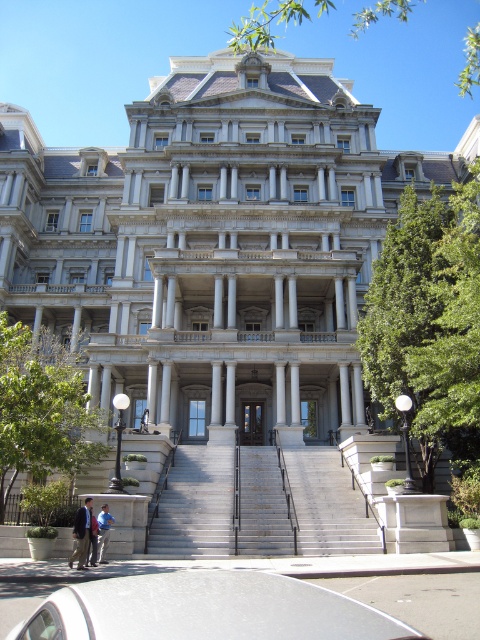
Question: Is silver metallic car at lower center wider than dark gray suit at lower left?

Choices:
 (A) yes
 (B) no

Answer: (A)

Question: Is gray concrete stairs at center thinner than blue denim jeans at lower left?

Choices:
 (A) no
 (B) yes

Answer: (A)

Question: Which object is closer to the camera taking this photo?

Choices:
 (A) blue denim jeans at lower left
 (B) gray concrete stairs at center

Answer: (A)

Question: Estimate the real-world distances between objects in this image. Which object is closer to the silver metallic car at lower center?

Choices:
 (A) dark gray suit at lower left
 (B) gray concrete stairs at center
 (C) blue denim jeans at lower left

Answer: (B)

Question: Which of the following is the farthest from the observer?

Choices:
 (A) blue denim jeans at lower left
 (B) gray concrete stairs at center
 (C) silver metallic car at lower center

Answer: (B)

Question: Is the position of dark gray suit at lower left more distant than that of blue denim jeans at lower left?

Choices:
 (A) no
 (B) yes

Answer: (A)